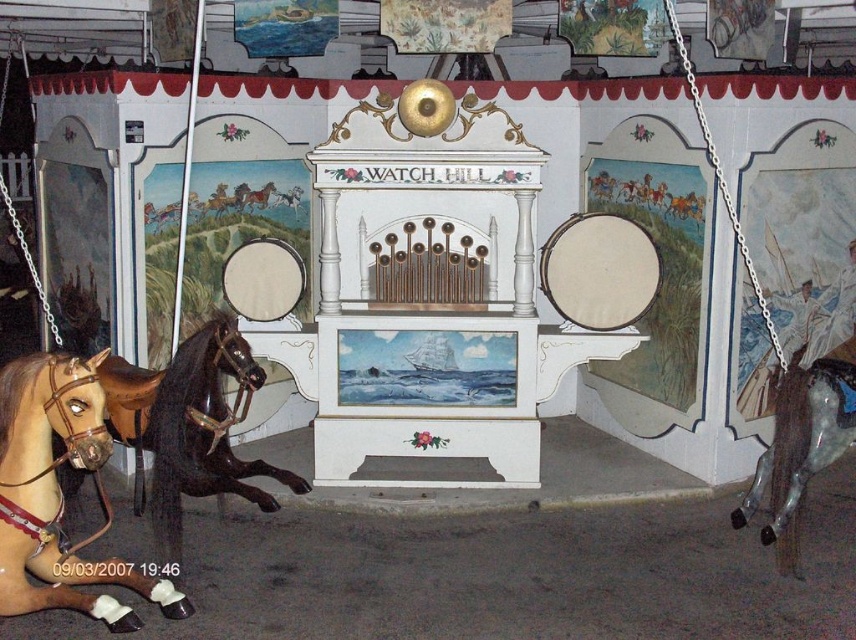
Question: Is brown glossy horse at lower left wider than brown glossy horse at left?

Choices:
 (A) no
 (B) yes

Answer: (A)

Question: In this image, where is brown glossy horse at lower left located relative to brown glossy horse at left?

Choices:
 (A) above
 (B) below

Answer: (B)

Question: Estimate the real-world distances between objects in this image. Which object is closer to the brown glossy horse at lower left?

Choices:
 (A) brown glossy horse at left
 (B) shiny metallic horse at right

Answer: (A)

Question: Does brown glossy horse at lower left appear on the right side of brown glossy horse at left?

Choices:
 (A) yes
 (B) no

Answer: (B)

Question: Which point is closer to the camera taking this photo?

Choices:
 (A) (179, 435)
 (B) (780, 502)
 (C) (33, 433)

Answer: (C)

Question: Estimate the real-world distances between objects in this image. Which object is farther from the brown glossy horse at left?

Choices:
 (A) brown glossy horse at lower left
 (B) shiny metallic horse at right

Answer: (B)